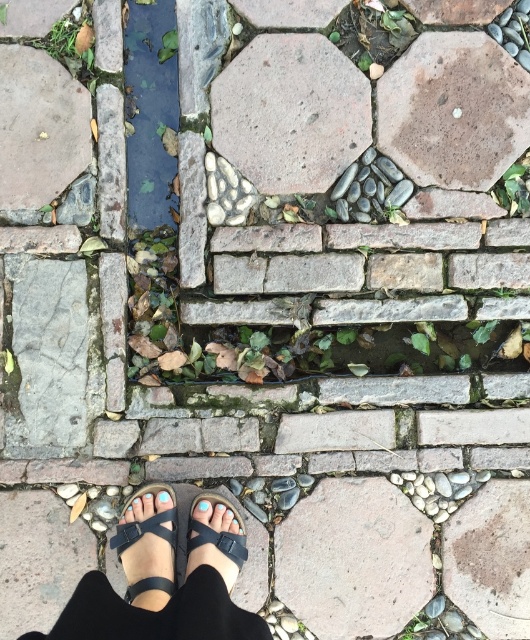
Question: Which object is closer to the camera taking this photo?

Choices:
 (A) smooth gray stone at center
 (B) brown rough hexagon at center
 (C) brown matte stone at center

Answer: (A)

Question: Which object is positioned farthest from the brown matte stone at center?

Choices:
 (A) smooth gray stone at center
 (B) brown rough hexagon at center
 (C) black leather sandal at lower left

Answer: (B)

Question: Is black matte sandal at lower center thinner than smooth gray stone at upper center?

Choices:
 (A) no
 (B) yes

Answer: (B)

Question: Does brown matte hexagon at upper center appear under black leather sandal at lower left?

Choices:
 (A) yes
 (B) no

Answer: (B)

Question: Is brown matte hexagon at upper center to the right of smooth gray stone at upper center from the viewer's perspective?

Choices:
 (A) no
 (B) yes

Answer: (B)

Question: Which point is closer to the camera?

Choices:
 (A) brown matte hexagon at upper center
 (B) gray stone at upper left
 (C) smooth gray stone at upper center

Answer: (B)